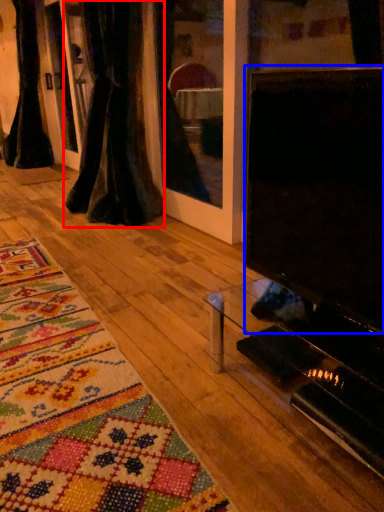
Question: Which point is further to the camera, curtain (highlighted by a red box) or screen (highlighted by a blue box)?

Choices:
 (A) curtain
 (B) screen

Answer: (A)